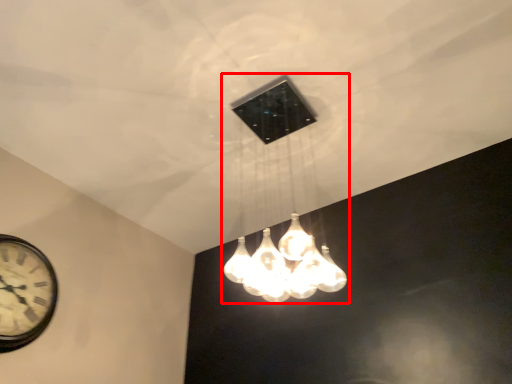
Question: Observing the image, what is the correct spatial positioning of lamp (annotated by the red box) in reference to wall clock?

Choices:
 (A) left
 (B) right

Answer: (B)